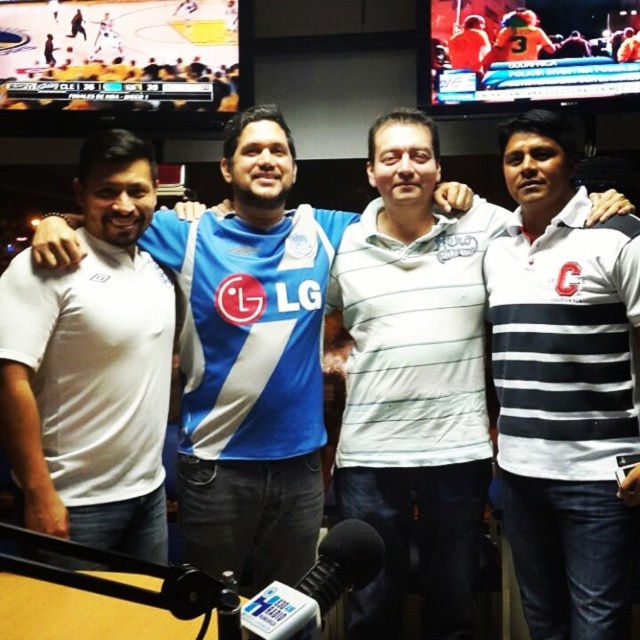
How much distance is there between white matte t-shirt at left and black matte microphone at lower center?

white matte t-shirt at left and black matte microphone at lower center are 38.20 inches apart from each other.

Is white matte t-shirt at left closer to the viewer compared to black matte microphone at lower center?

That is False.

Is point (147, 401) closer to camera compared to point (317, 586)?

No, it is behind (317, 586).

Where is `white matte t-shirt at left`? white matte t-shirt at left is located at coordinates (92, 365).

Image resolution: width=640 pixels, height=640 pixels. What do you see at coordinates (252, 360) in the screenshot?
I see `blue jersey at center` at bounding box center [252, 360].

Does point (61, 264) come farther from viewer compared to point (131, 516)?

That is False.

Locate an element on the screen. blue jersey at center is located at coordinates (252, 360).

Does white striped polo shirt at center have a lesser height compared to black matte microphone at lower center?

Incorrect, white striped polo shirt at center's height does not fall short of black matte microphone at lower center's.

What do you see at coordinates (563, 388) in the screenshot? Image resolution: width=640 pixels, height=640 pixels. I see `white striped polo shirt at center` at bounding box center [563, 388].

Describe the element at coordinates (563, 388) in the screenshot. This screenshot has width=640, height=640. I see `white striped polo shirt at center` at that location.

Image resolution: width=640 pixels, height=640 pixels. What are the coordinates of `white striped polo shirt at center` in the screenshot? It's located at click(563, 388).